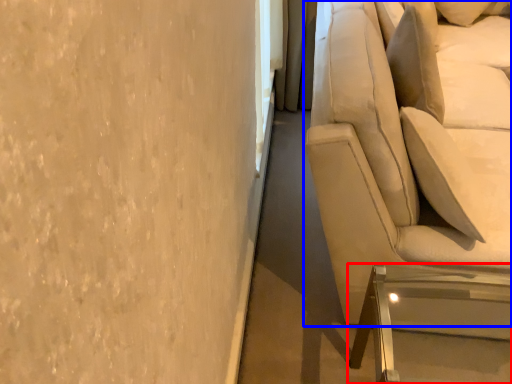
Question: Which of the following is the farthest to the observer, furniture (highlighted by a red box) or studio couch (highlighted by a blue box)?

Choices:
 (A) furniture
 (B) studio couch

Answer: (A)